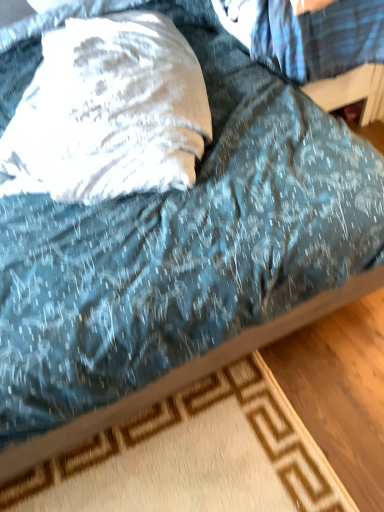
The height and width of the screenshot is (512, 384). What do you see at coordinates (109, 112) in the screenshot?
I see `white textured pillow at upper left` at bounding box center [109, 112].

Identify the location of white textured pillow at upper left. The width and height of the screenshot is (384, 512). tap(109, 112).

The height and width of the screenshot is (512, 384). In order to click on white textured pillow at upper left in this screenshot , I will do `click(109, 112)`.